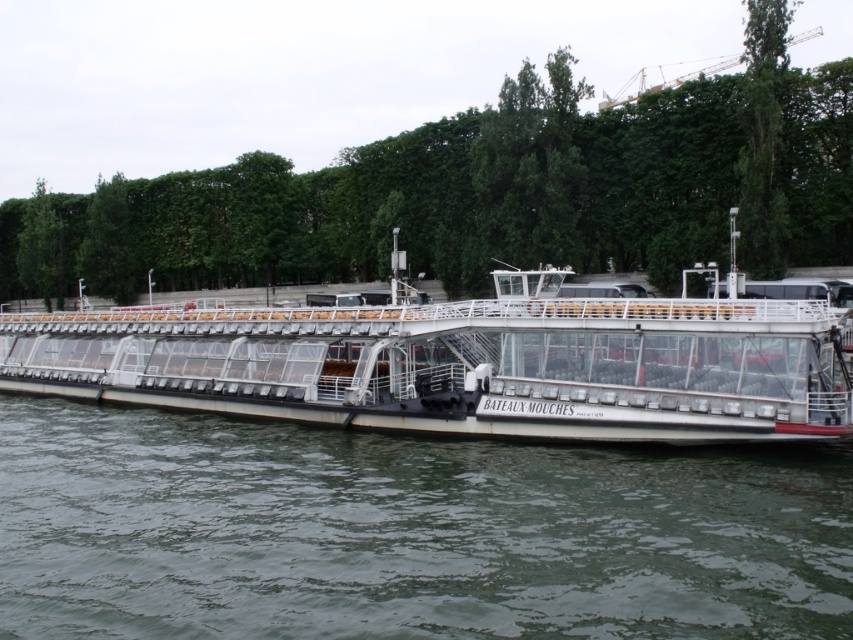
You are standing on the Bateaux Mouches cruise boat and looking out towards the river. There is a point marked at coordinates (405, 532). What is located at that point?

The point at coordinates (405, 532) marks white glossy water at center.

You are standing on the upper deck of the Bateaux Mouches boat and looking towards the riverbank. There are two points marked on the deck at coordinates point (437, 148) and point (206, 312). Which point is closer to the riverbank?

Point (206, 312) is closer to the riverbank because it is in front of point (437, 148), which is behind it.